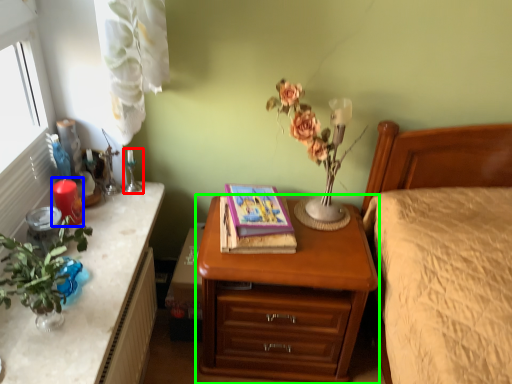
Question: Estimate the real-world distances between objects in this image. Which object is closer to candle holder (highlighted by a red box), candle (highlighted by a blue box) or nightstand (highlighted by a green box)?

Choices:
 (A) candle
 (B) nightstand

Answer: (A)